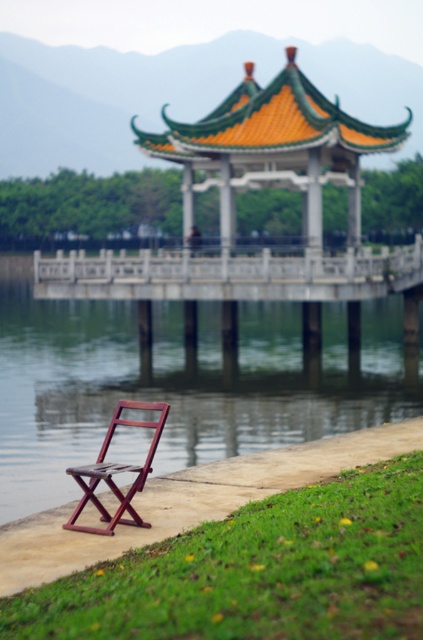
Question: Which point appears farthest from the camera in this image?

Choices:
 (A) (132, 520)
 (B) (140, 134)
 (C) (52, 401)

Answer: (B)

Question: Considering the relative positions of transparent water at chair left and mahogany wood folding chair at lower left in the image provided, where is transparent water at chair left located with respect to mahogany wood folding chair at lower left?

Choices:
 (A) above
 (B) below

Answer: (A)

Question: Does transparent water at chair left come behind green glazed tiles at center?

Choices:
 (A) no
 (B) yes

Answer: (A)

Question: Which point is closer to the camera?

Choices:
 (A) (362, 381)
 (B) (131, 506)
 (C) (266, 141)

Answer: (B)

Question: Is transparent water at chair left smaller than mahogany wood folding chair at lower left?

Choices:
 (A) no
 (B) yes

Answer: (A)

Question: Which object is positioned farthest from the transparent water at chair left?

Choices:
 (A) mahogany wood folding chair at lower left
 (B) green glazed tiles at center

Answer: (A)